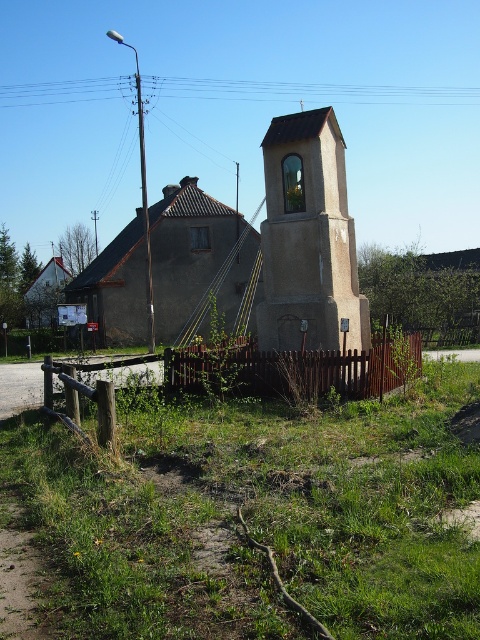
You are a painter who wants to paint the gray concrete church at center and the brown wooden fence at center. Since you need to know which one is taller to estimate the amount of paint required, can you tell me which object is taller?

The gray concrete church at center has a greater height compared to the brown wooden fence at center, so the gray concrete church at center is taller.

You are a painter standing in front of the smooth concrete bell tower at center and the brown wooden fence at center. You want to paint the fence first. Which object should you move closer to first?

The brown wooden fence at center is behind the smooth concrete bell tower at center, so you should move closer to the smooth concrete bell tower at center first to reach the fence behind it.

You are standing at the point marked as point (195, 256). What structure are you directly in front of?

The gray concrete church at center is located at point (195, 256), so you are directly in front of the gray concrete church at center.